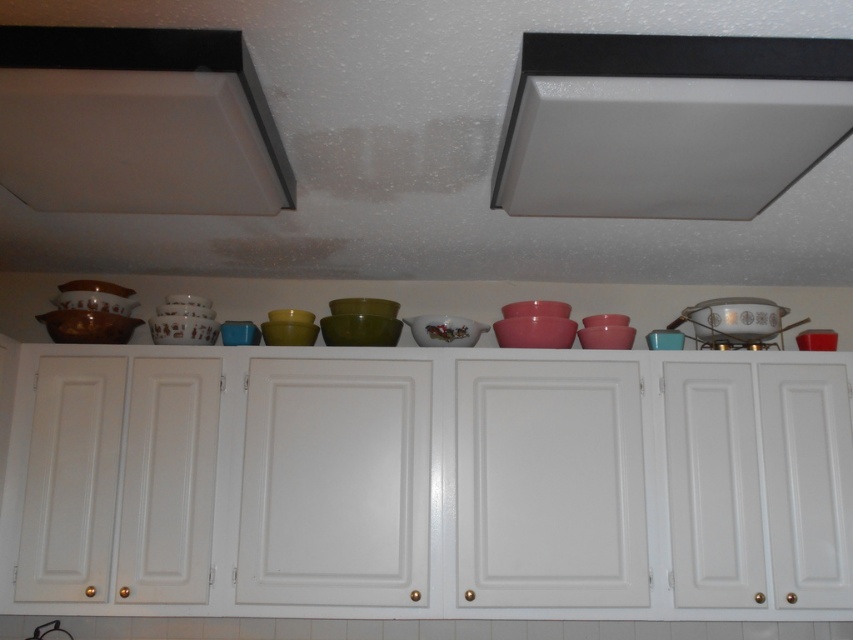
Can you confirm if white matte exhaust hood at upper center is smaller than matte white exhaust hood at upper left?

No.

Who is more distant from viewer, (717, 83) or (157, 49)?

Point (717, 83)

Does point (664, 163) lie behind point (202, 67)?

Yes, it is behind point (202, 67).

I want to click on white matte exhaust hood at upper center, so click(x=666, y=124).